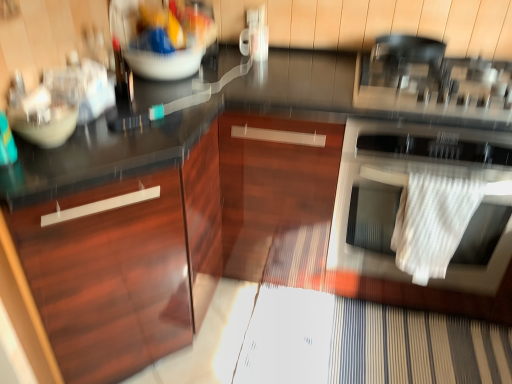
What do you see at coordinates (432, 223) in the screenshot? I see `white textured towel at right` at bounding box center [432, 223].

The width and height of the screenshot is (512, 384). In order to click on white textured towel at right in this screenshot , I will do `click(432, 223)`.

The height and width of the screenshot is (384, 512). Identify the location of white textured towel at right. (393, 254).

Describe the element at coordinates (393, 254) in the screenshot. The width and height of the screenshot is (512, 384). I see `white textured towel at right` at that location.

This screenshot has height=384, width=512. What are the coordinates of `white textured towel at right` in the screenshot? It's located at (432, 223).

Does white textured towel at right have a greater width compared to glossy wood cabinet at left?

No, white textured towel at right is not wider than glossy wood cabinet at left.

Which object is further away from the camera, white textured towel at right or glossy wood cabinet at left?

white textured towel at right is further from the camera.

Is point (424, 227) closer or farther from the camera than point (159, 347)?

Point (424, 227) is positioned closer to the camera compared to point (159, 347).

In terms of height, does white textured towel at right look taller or shorter compared to glossy wood cabinet at left?

Clearly, white textured towel at right is shorter compared to glossy wood cabinet at left.

From their relative heights in the image, would you say white textured towel at right is taller or shorter than matte white bowl at left?

In the image, white textured towel at right appears to be taller than matte white bowl at left.

From a real-world perspective, is white textured towel at right physically located above or below matte white bowl at left?

In terms of real-world spatial position, white textured towel at right is below matte white bowl at left.

Is white textured towel at right looking in the opposite direction of matte white bowl at left?

white textured towel at right is not turned away from matte white bowl at left.

Based on the photo, from the image's perspective, is white textured towel at right located above or below matte white bowl at left?

From the image's perspective, white textured towel at right appears below matte white bowl at left.

From a real-world perspective, who is located higher, white textured towel at right or matte plastic bowl at upper center?

In real-world perspective, matte plastic bowl at upper center is above.

Does white textured towel at right have a greater height compared to matte plastic bowl at upper center?

Correct, white textured towel at right is much taller as matte plastic bowl at upper center.

Locate an element on the screen. The image size is (512, 384). home appliance in front of the matte plastic bowl at upper center is located at coordinates (393, 254).

Is white textured towel at right oriented towards matte plastic bowl at upper center?

No, white textured towel at right is not oriented towards matte plastic bowl at upper center.

Measure the distance from matte plastic bowl at upper center to glossy wood cabinet at left.

matte plastic bowl at upper center and glossy wood cabinet at left are 76.98 centimeters apart.

Is matte plastic bowl at upper center looking in the opposite direction of glossy wood cabinet at left?

That's not correct — matte plastic bowl at upper center is not looking away from glossy wood cabinet at left.

Find the location of `cabinetry that is below the matte plastic bowl at upper center (from the image's perspective)`. cabinetry that is below the matte plastic bowl at upper center (from the image's perspective) is located at coordinates (109, 278).

Is matte plastic bowl at upper center inside the boundaries of glossy wood cabinet at left, or outside?

matte plastic bowl at upper center is spatially situated outside glossy wood cabinet at left.

Which of these two, glossy wood cabinet at left or matte plastic bowl at upper center, is wider?

glossy wood cabinet at left is wider.

Is glossy wood cabinet at left at the right side of matte plastic bowl at upper center?

No.

I want to click on cabinetry in front of the matte plastic bowl at upper center, so click(x=109, y=278).

Are glossy wood cabinet at left and matte plastic bowl at upper center beside each other?

No.

From a real-world perspective, who is located lower, matte white bowl at left or white textured towel at right?

From a 3D spatial view, white textured towel at right is below.

Considering the sizes of objects matte white bowl at left and white textured towel at right in the image provided, who is shorter, matte white bowl at left or white textured towel at right?

matte white bowl at left.

Consider the image. From the image's perspective, which is below, matte white bowl at left or white textured towel at right?

white textured towel at right is shown below in the image.

Is point (58, 112) positioned after point (465, 291)?

No, it is not.

Consider the image. Is glossy wood cabinet at left located outside white textured towel at right?

That's correct, glossy wood cabinet at left is outside of white textured towel at right.

Is white textured towel at right at the back of glossy wood cabinet at left?

No, white textured towel at right is not at the back of glossy wood cabinet at left.

In terms of width, does glossy wood cabinet at left look wider or thinner when compared to white textured towel at right?

Clearly, glossy wood cabinet at left has less width compared to white textured towel at right.

What's the angular difference between glossy wood cabinet at left and white textured towel at right's facing directions?

The angular difference between glossy wood cabinet at left and white textured towel at right is 90.4 degrees.

Locate an element on the screen. Image resolution: width=512 pixels, height=384 pixels. cabinetry located below the white textured towel at right (from the image's perspective) is located at coordinates (109, 278).

Identify the location of mixing bowl located above the white textured towel at right (from the image's perspective). The height and width of the screenshot is (384, 512). (44, 124).

Which object lies further to the anchor point white textured towel at right, white textured towel at right or matte white bowl at left?

Based on the image, matte white bowl at left appears to be further to white textured towel at right.

Estimate the real-world distances between objects in this image. Which object is closer to matte plastic bowl at upper center, matte white bowl at left or white textured towel at right?

The object closer to matte plastic bowl at upper center is matte white bowl at left.

Which object lies further to the anchor point glossy wood cabinet at left, matte plastic bowl at upper center or white textured towel at right?

Based on the image, white textured towel at right appears to be further to glossy wood cabinet at left.

From the picture: Considering their positions, is glossy wood cabinet at left positioned closer to matte white bowl at left than white textured towel at right?

glossy wood cabinet at left.

From the image, which object appears to be nearer to matte plastic bowl at upper center, glossy wood cabinet at left or white textured towel at right?

glossy wood cabinet at left is closer to matte plastic bowl at upper center.

Estimate the real-world distances between objects in this image. Which object is further from matte plastic bowl at upper center, white textured towel at right or glossy wood cabinet at left?

Among the two, white textured towel at right is located further to matte plastic bowl at upper center.

From the image, which object appears to be farther from white textured towel at right, glossy wood cabinet at left or matte plastic bowl at upper center?

matte plastic bowl at upper center is positioned further to the anchor white textured towel at right.

Which object lies further to the anchor point glossy wood cabinet at left, matte plastic bowl at upper center or white textured towel at right?

matte plastic bowl at upper center lies further to glossy wood cabinet at left than the other object.

Find the location of a particular element. This screenshot has height=384, width=512. material situated between matte white bowl at left and white textured towel at right from left to right is located at coordinates (x=432, y=223).

In order to click on cabinetry situated between matte white bowl at left and white textured towel at right from left to right in this screenshot , I will do `click(109, 278)`.

The height and width of the screenshot is (384, 512). What are the coordinates of `material between matte plastic bowl at upper center and white textured towel at right` in the screenshot? It's located at (432, 223).

I want to click on cabinetry between matte white bowl at left and white textured towel at right from left to right, so click(x=109, y=278).